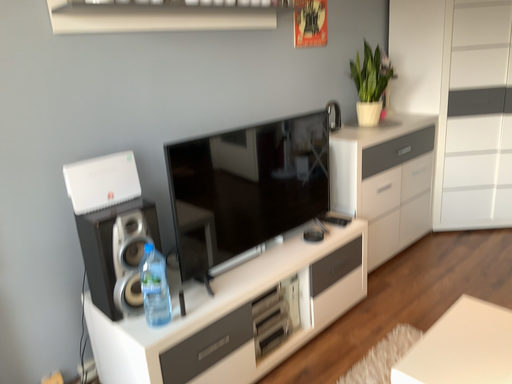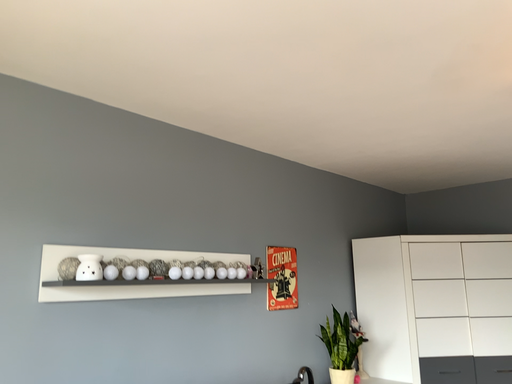
Question: Which way did the camera rotate in the video?

Choices:
 (A) rotated upward
 (B) rotated downward

Answer: (A)